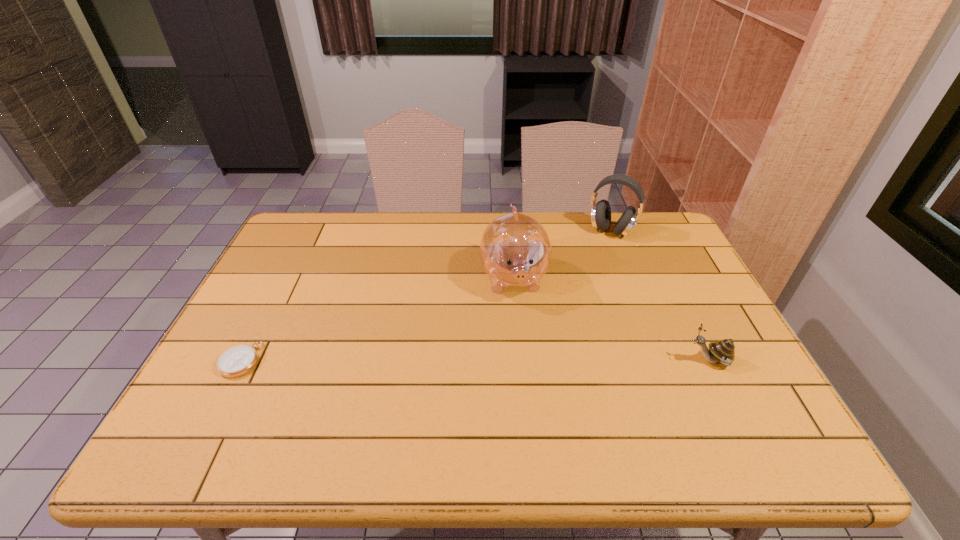
At what (x,y) coordinates should I click in order to perform the action: click on free space located 0.170m on the front facing side of the piggy bank. Please return your answer as a coordinate pair (x, y). The image size is (960, 540). Looking at the image, I should click on (526, 355).

The width and height of the screenshot is (960, 540). Identify the location of vacant space located on the front facing side of the piggy bank. (521, 328).

Locate an element on the screen. The height and width of the screenshot is (540, 960). vacant space located on the front facing side of the piggy bank is located at coordinates (535, 407).

The image size is (960, 540). Identify the location of free point located 0.150m on the ear cups of the farthest object. (585, 265).

Where is `free space located on the ear cups of the farthest object`? The height and width of the screenshot is (540, 960). free space located on the ear cups of the farthest object is located at coordinates (569, 287).

The height and width of the screenshot is (540, 960). I want to click on free space located 0.200m on the ear cups of the farthest object, so click(x=579, y=274).

This screenshot has height=540, width=960. I want to click on object that is at the far edge, so click(x=600, y=212).

Where is `object present at the left edge`? object present at the left edge is located at coordinates (238, 360).

Locate an element on the screen. This screenshot has width=960, height=540. snail located at the right edge is located at coordinates (723, 351).

Find the location of a particular element. The image size is (960, 540). headset that is positioned at the right edge is located at coordinates (600, 212).